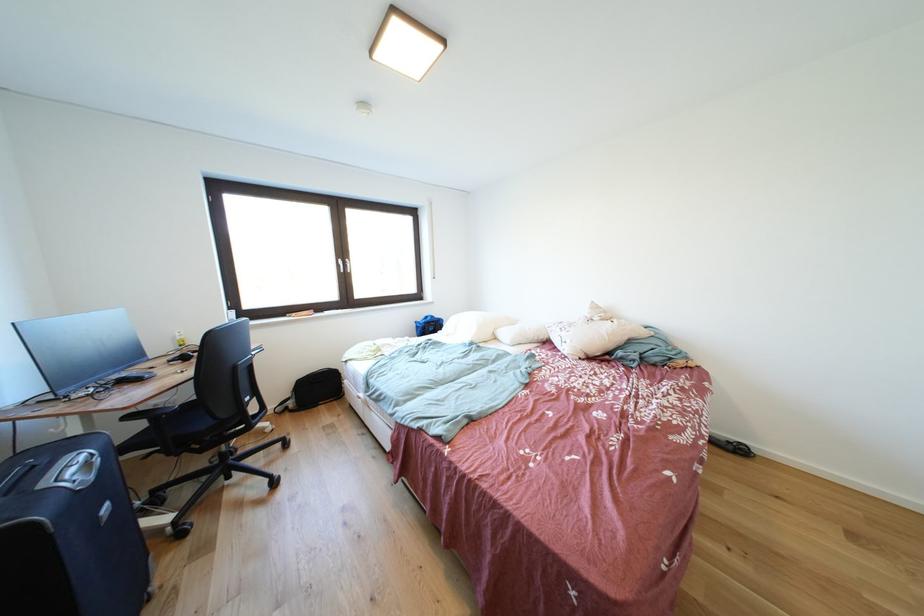
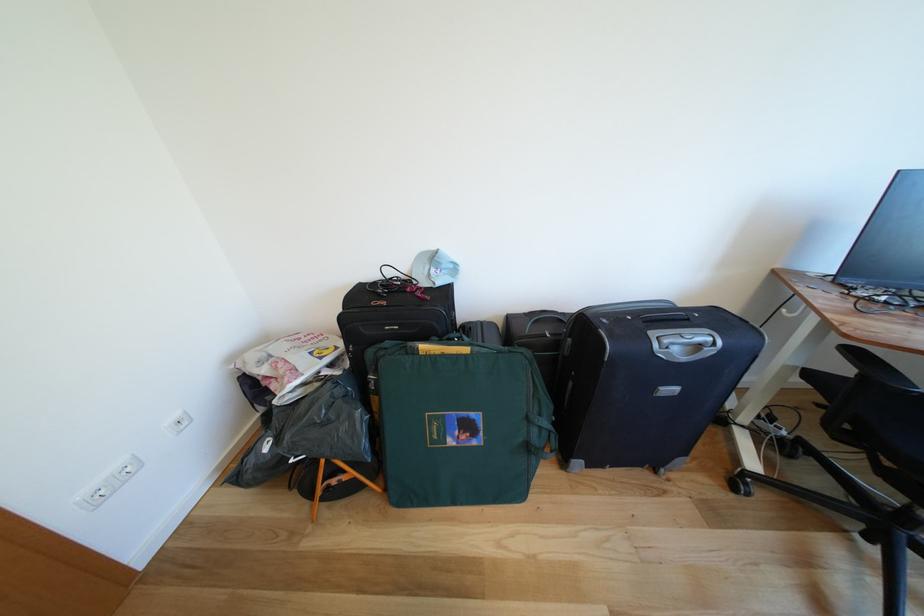
Find the pixel in the second image that matches (x=94, y=468) in the first image.

(707, 351)